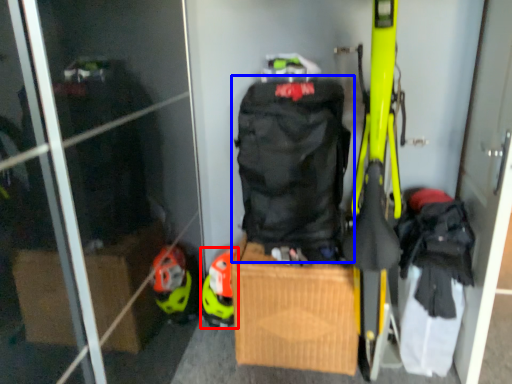
Question: Among these objects, which one is nearest to the camera, helmet (highlighted by a red box) or backpack (highlighted by a blue box)?

Choices:
 (A) helmet
 (B) backpack

Answer: (B)